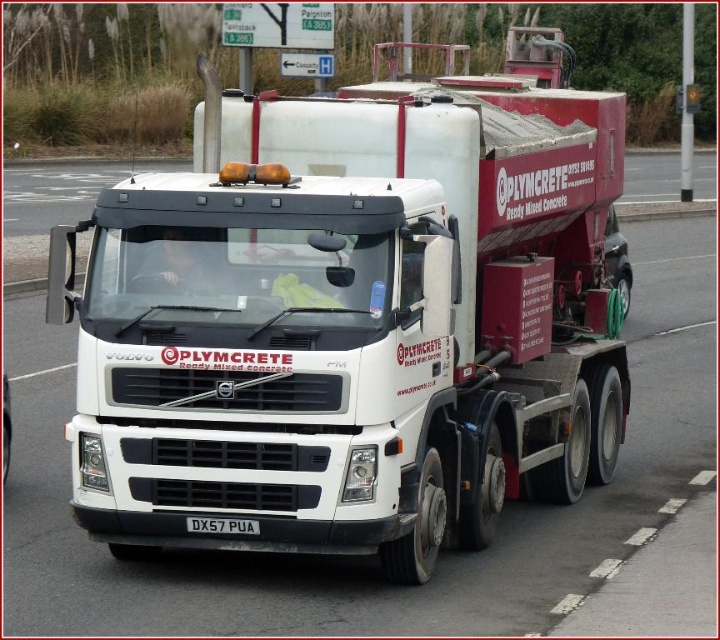
You are standing at the front of the Volvo FM truck and want to locate two points marked on its body. The first point is at coordinates point (x=264, y=323) and the second is at point (x=192, y=524). Which point is closer to you?

Point (x=264, y=323) is in front of point (x=192, y=524), so the first point is closer to you.

You are a delivery driver who needs to park the Volvo FM truck under a low bridge. The bridge has a height restriction of 4 meters. The white plastic license plate at center is exactly at 3.8 meters height. Can the white matte concrete mixer at center pass under the bridge without hitting it?

The white matte concrete mixer at center is taller than the white plastic license plate at center, which is at 3.8 meters. Since the mixer is taller than the license plate, its height exceeds the 4 meter bridge restriction. Therefore, the truck cannot pass under the bridge without hitting it.

You are a delivery driver who needs to park this Volvo FM truck in a loading bay that is 3 meters wide. The truck has a white matte concrete mixer at center and a white plastic license plate at center. Will the truck fit in the loading bay if you align the license plate with the entrance?

The distance between the white matte concrete mixer at center and the white plastic license plate at center is 2.41 meters. Since the loading bay is 3 meters wide, the truck will fit as the width required is less than the available space.